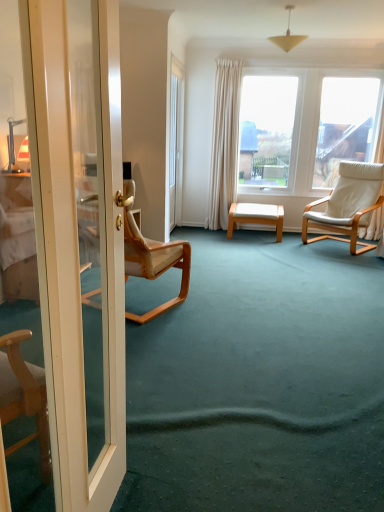
Question: Considering the relative sizes of white leather chair at right, the first chair in the right-to-left sequence, and transparent glass door at center in the image provided, is white leather chair at right, the first chair in the right-to-left sequence, taller than transparent glass door at center?

Choices:
 (A) yes
 (B) no

Answer: (B)

Question: Considering the relative positions of white leather chair at right, which is counted as the 2th chair, starting from the left, and transparent glass door at center in the image provided, is white leather chair at right, which is counted as the 2th chair, starting from the left, to the left of transparent glass door at center from the viewer's perspective?

Choices:
 (A) no
 (B) yes

Answer: (A)

Question: Does white leather chair at right, which ranks as the first chair in back-to-front order, turn towards transparent glass door at center?

Choices:
 (A) no
 (B) yes

Answer: (A)

Question: Is white leather chair at right, the 2th chair in the front-to-back sequence, not within transparent glass door at center?

Choices:
 (A) yes
 (B) no

Answer: (A)

Question: Is white leather chair at right, which ranks as the first chair in back-to-front order, directly adjacent to transparent glass door at center?

Choices:
 (A) yes
 (B) no

Answer: (B)

Question: In the image, is white wood stool at center positioned in front of or behind light beige wood chair at left, which is the second chair from right to left?

Choices:
 (A) front
 (B) behind

Answer: (B)

Question: Does point (268, 212) appear closer or farther from the camera than point (127, 270)?

Choices:
 (A) closer
 (B) farther

Answer: (B)

Question: Is white wood stool at center to the left or to the right of light beige wood chair at left, the 2th chair viewed from the back, in the image?

Choices:
 (A) right
 (B) left

Answer: (A)

Question: Is white wood stool at center wider or thinner than light beige wood chair at left, which is the second chair from right to left?

Choices:
 (A) wide
 (B) thin

Answer: (B)

Question: Based on their sizes in the image, would you say transparent glass door at center is bigger or smaller than white glossy door at left?

Choices:
 (A) big
 (B) small

Answer: (A)

Question: Considering the positions of transparent glass door at center and white glossy door at left in the image, is transparent glass door at center wider or thinner than white glossy door at left?

Choices:
 (A) wide
 (B) thin

Answer: (B)

Question: Considering their positions, is transparent glass door at center located in front of or behind white glossy door at left?

Choices:
 (A) behind
 (B) front

Answer: (A)

Question: In terms of height, does transparent glass door at center look taller or shorter compared to white glossy door at left?

Choices:
 (A) tall
 (B) short

Answer: (A)

Question: Is white glossy door at left taller or shorter than transparent glass door at center?

Choices:
 (A) tall
 (B) short

Answer: (B)

Question: Considering the positions of white glossy door at left and transparent glass door at center in the image, is white glossy door at left bigger or smaller than transparent glass door at center?

Choices:
 (A) big
 (B) small

Answer: (B)